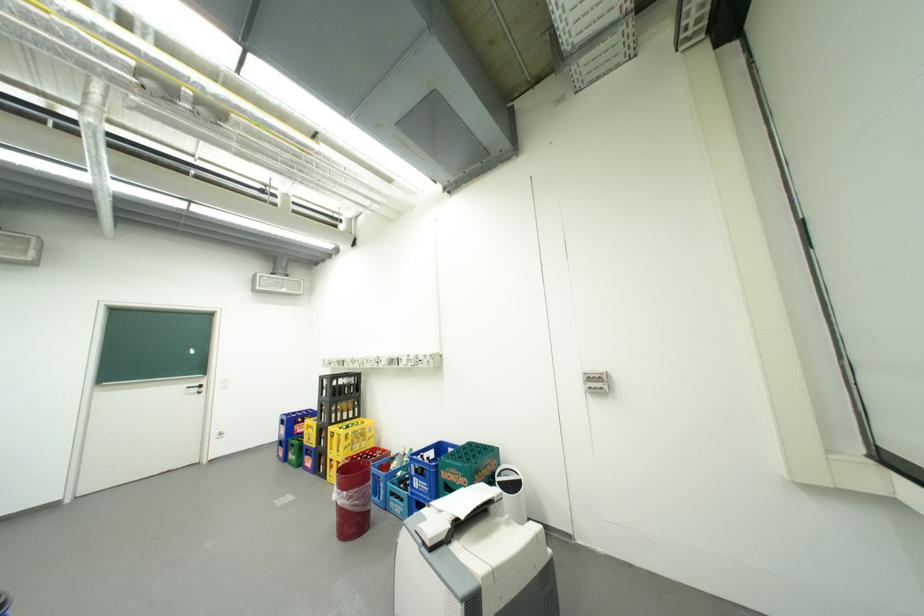
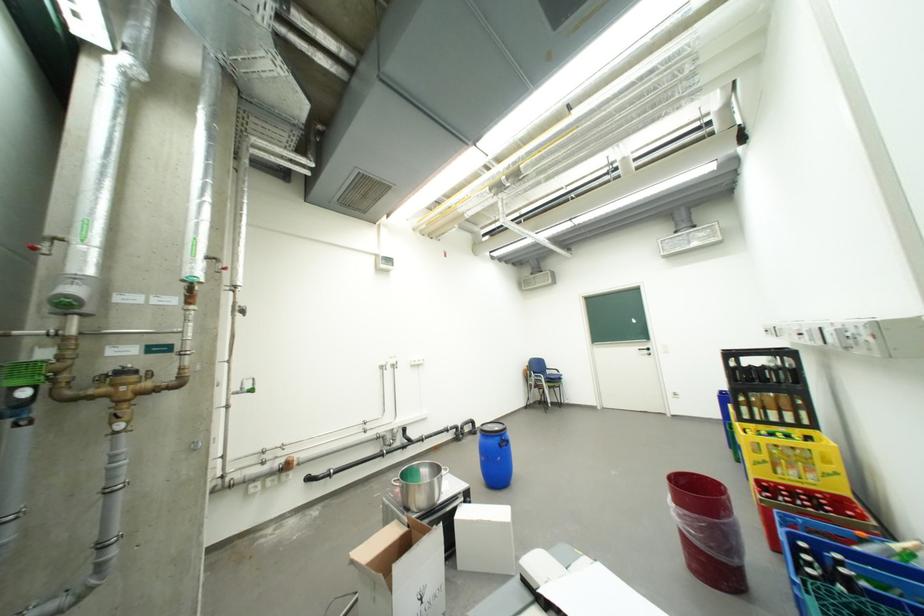
Where in the second image is the point corresponding to point 199,389 from the first image?

(650, 351)